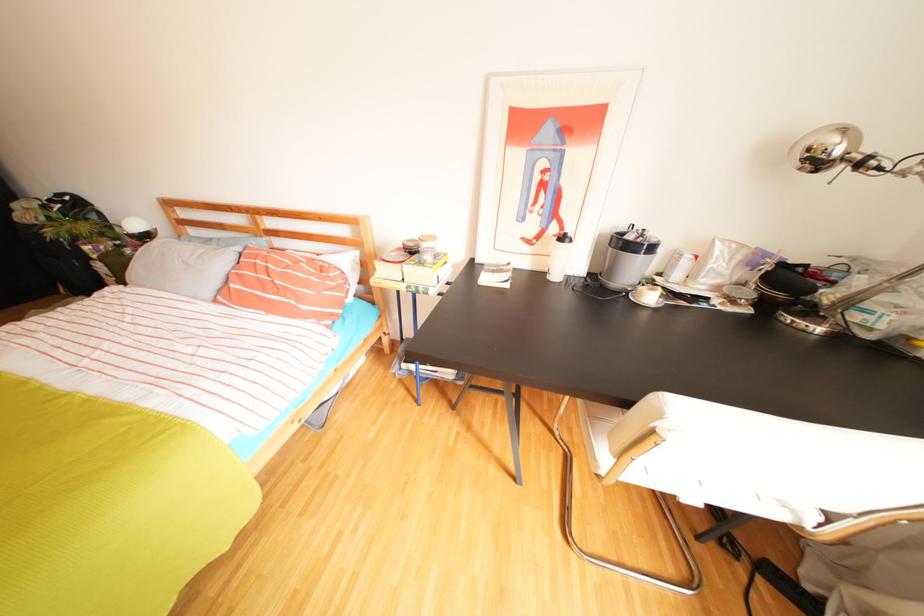
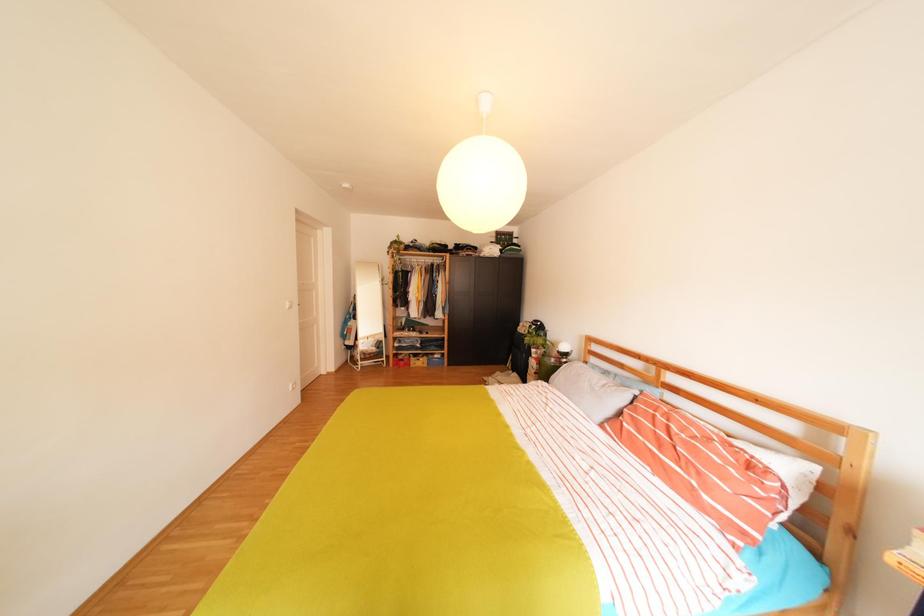
Question: The camera is either moving clockwise (left) or counter-clockwise (right) around the object. The first image is from the beginning of the video and the second image is from the end. Is the camera moving left or right when shooting the video?

Choices:
 (A) Left
 (B) Right

Answer: (B)